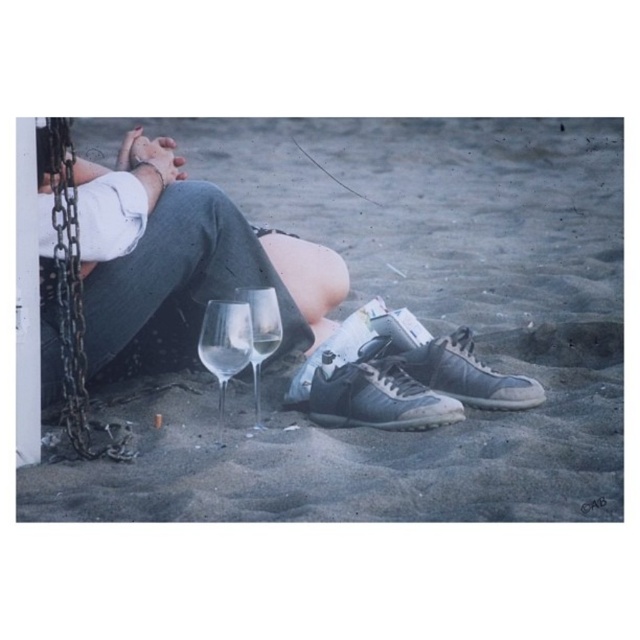
You are a photographer trying to capture the rusty metal chain at left and the leather sneakers at lower center in the same frame. Based on their positions, which object should you focus on first to ensure both are in the shot?

The rusty metal chain at left is above the leather sneakers at lower center, so you should focus on the leather sneakers at lower center first to ensure both are in the shot.

You are a lifeguard standing at the edge of the beach. You need to retrieve both the matte black shoes at lower center and the rusty metal chain at left for safety inspection. What is the minimum distance you must walk to collect both items starting from your position?

The minimum distance you must walk to collect both items is 2.80 meters, as the matte black shoes at lower center and the rusty metal chain at left are 2.80 meters apart.